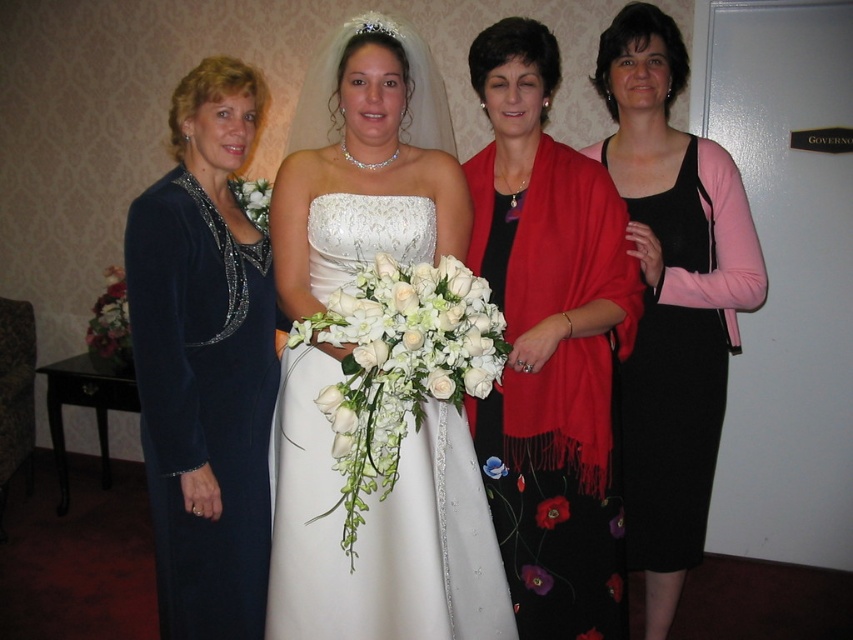
Where is the dark blue velvet dress at left located in the image?

The dark blue velvet dress at left is located at point (206, 360) in the image.

You are a photographer at a wedding. You need to adjust the lighting to highlight both the white satin dress at center and the white silk bouquet at center. Since they are both white, how can you tell which one is lower in the image?

The white satin dress at center is located below the white silk bouquet at center, so the dress is lower than the bouquet.